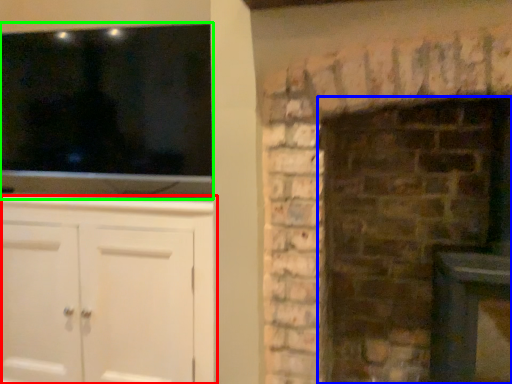
Question: Which object is positioned closest to cabinetry (highlighted by a red box)? Select from fireplace (highlighted by a blue box) and window (highlighted by a green box).

Choices:
 (A) fireplace
 (B) window

Answer: (B)